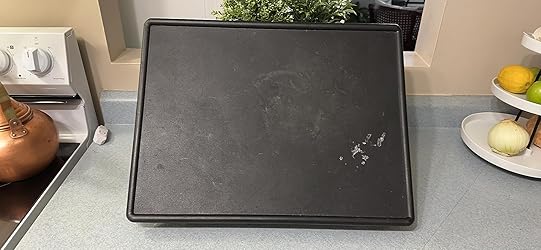
This screenshot has height=250, width=541. What are the coordinates of `wall` in the screenshot? It's located at (101, 42).